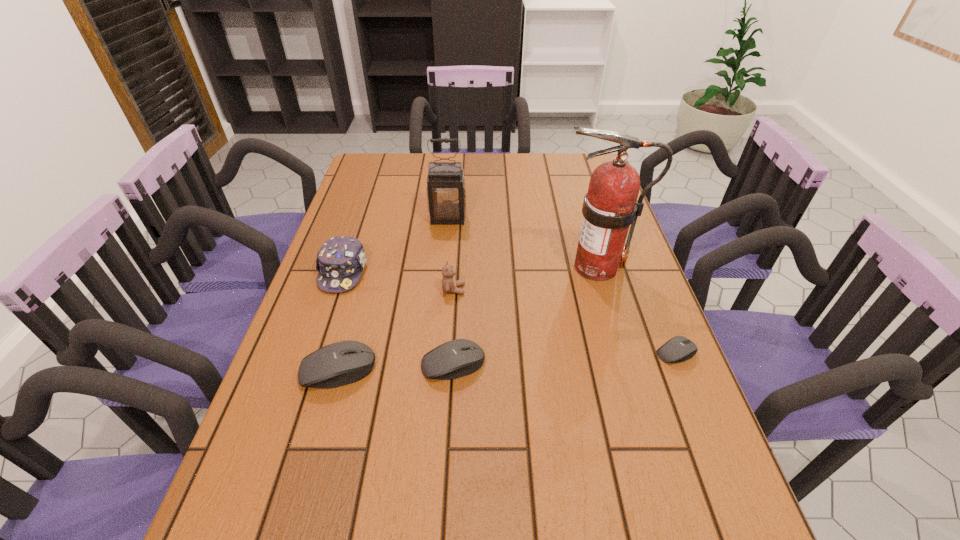
You are a GUI agent. You are given a task and a screenshot of the screen. Output one action in this format:
    pyautogui.click(x=<x>, y=<y>)
    Task: Click on the headwear located at the left edge
    The width and height of the screenshot is (960, 540).
    Given the screenshot: What is the action you would take?
    pyautogui.click(x=340, y=261)

You are a GUI agent. You are given a task and a screenshot of the screen. Output one action in this format:
    pyautogui.click(x=<x>, y=<y>)
    Task: Click on the computer equipment positioned at the right edge
    The width and height of the screenshot is (960, 540).
    Given the screenshot: What is the action you would take?
    pyautogui.click(x=678, y=349)

The height and width of the screenshot is (540, 960). Identify the location of fire extinguisher situated at the right edge. (610, 206).

In the image, there is a desktop. Identify the location of vacant space at the far edge. The height and width of the screenshot is (540, 960). (558, 171).

Locate an element on the screen. vacant region at the near edge is located at coordinates (358, 484).

The width and height of the screenshot is (960, 540). In the image, there is a desktop. Identify the location of vacant space at the left edge. (376, 195).

Identify the location of free space at the right edge of the desktop. (581, 193).

Find the location of a particular element. This screenshot has width=960, height=540. free space at the far left corner is located at coordinates (380, 153).

Locate an element on the screen. The image size is (960, 540). vacant area at the near left corner is located at coordinates (240, 494).

The image size is (960, 540). Find the location of `free region at the far right corner`. free region at the far right corner is located at coordinates tap(560, 153).